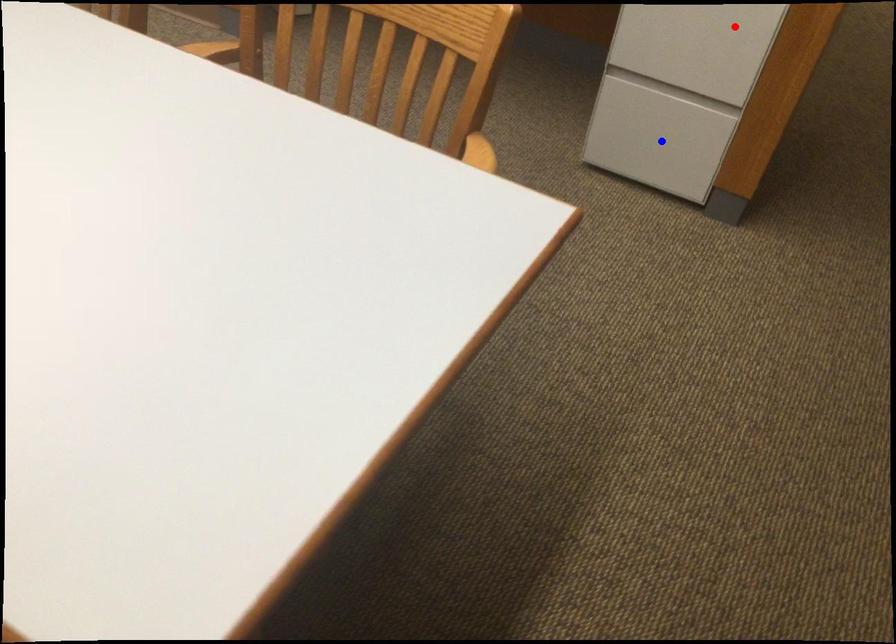
Question: In the image, two points are highlighted. Which point is nearer to the camera? Reply with the corresponding letter.

Choices:
 (A) blue point
 (B) red point

Answer: (B)